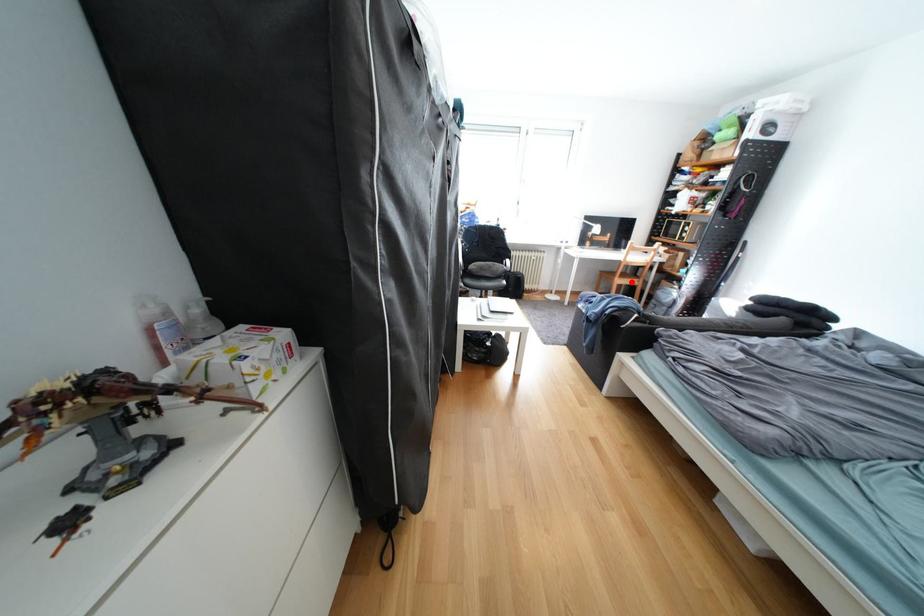
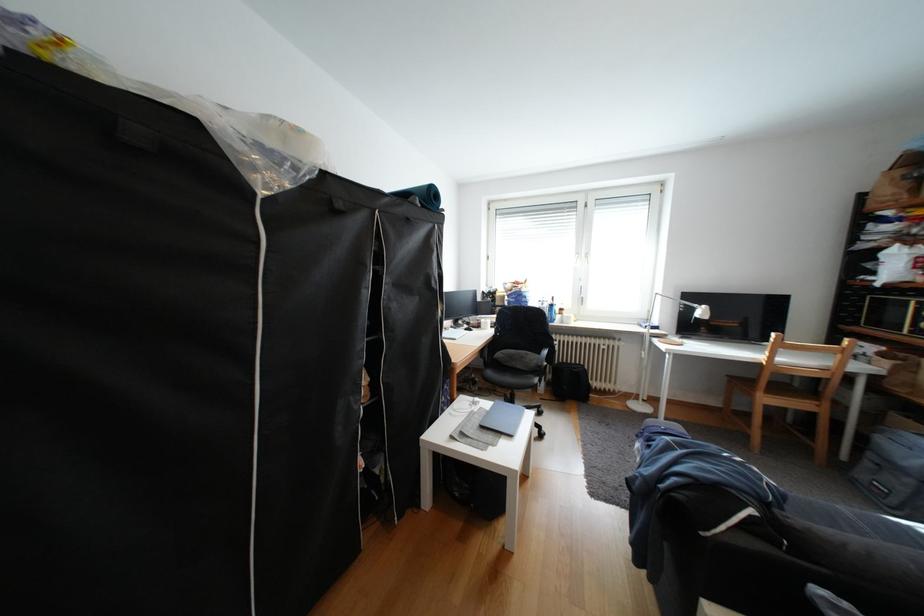
Find the pixel in the second image that matches the highlighted location in the first image.

(779, 400)